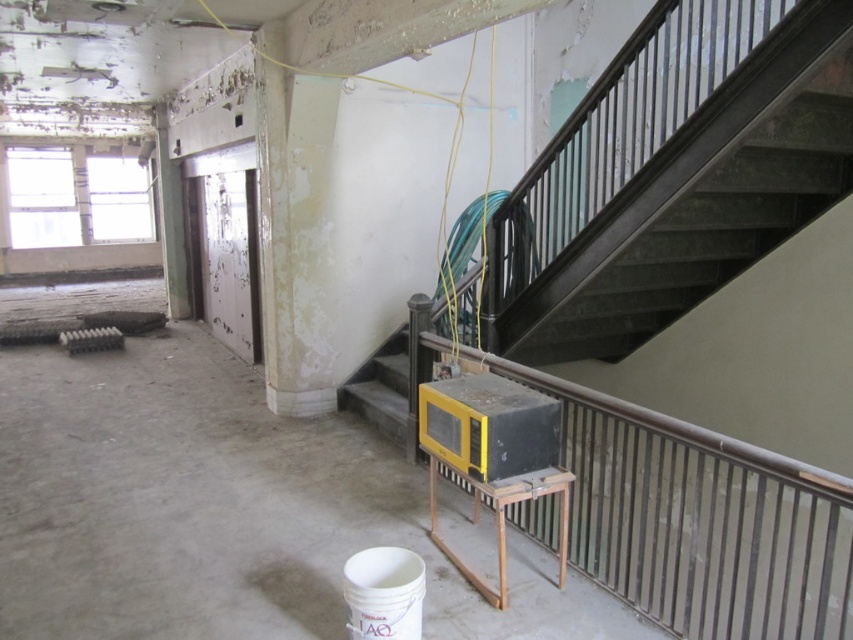
Question: Is wooden stool at center positioned before yellow plastic stairwell at center?

Choices:
 (A) yes
 (B) no

Answer: (A)

Question: Can you confirm if wooden stool at center is wider than yellow plastic stairwell at center?

Choices:
 (A) yes
 (B) no

Answer: (A)

Question: Which point is closer to the camera?

Choices:
 (A) wooden stool at center
 (B) yellow plastic stairwell at center

Answer: (A)

Question: Can you confirm if wooden stool at center is positioned to the left of yellow plastic stairwell at center?

Choices:
 (A) no
 (B) yes

Answer: (A)